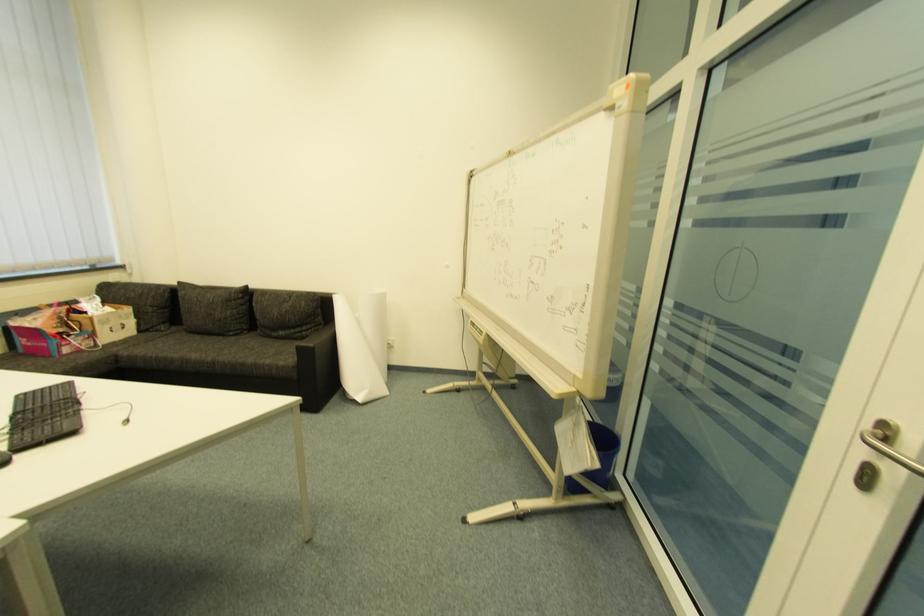
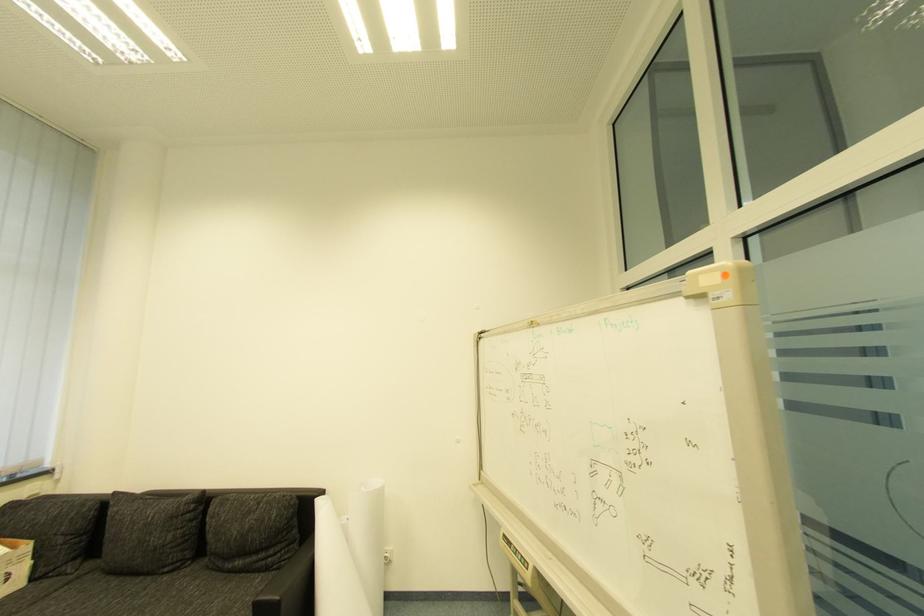
Which direction would the cameraman need to move to produce the second image?

The cameraman moved toward left, forward.